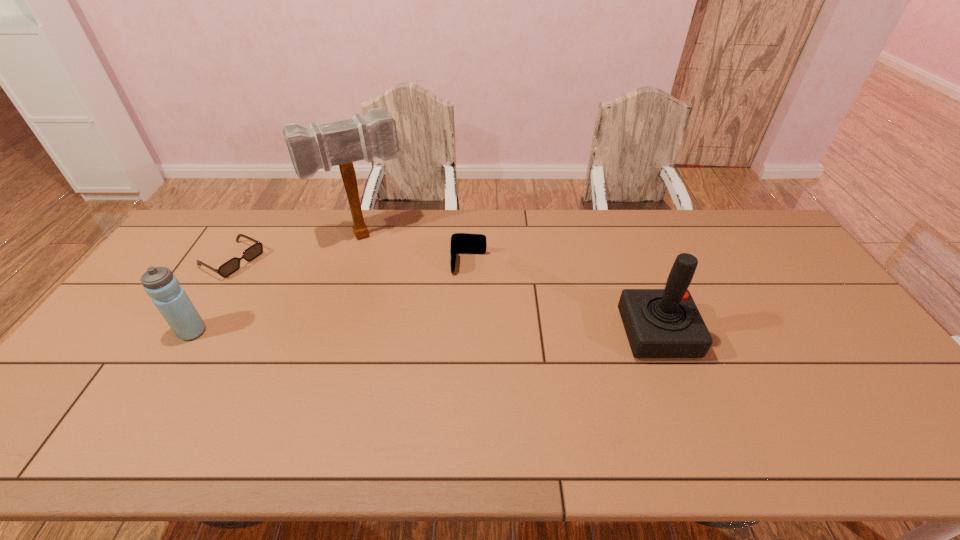
Locate an element on the screen. This screenshot has width=960, height=540. the third tallest object is located at coordinates (170, 298).

You are a GUI agent. You are given a task and a screenshot of the screen. Output one action in this format:
    pyautogui.click(x=<x>, y=<y>)
    Task: Click on the joystick
    The image size is (960, 540).
    Given the screenshot: What is the action you would take?
    pyautogui.click(x=659, y=323)

Where is `wallet`? This screenshot has width=960, height=540. wallet is located at coordinates (461, 243).

This screenshot has height=540, width=960. Identify the location of the fourth object from left to right. (461, 243).

The height and width of the screenshot is (540, 960). I want to click on the third object from right to left, so click(341, 143).

The width and height of the screenshot is (960, 540). In order to click on the tallest object in this screenshot , I will do coord(341,143).

The width and height of the screenshot is (960, 540). Find the location of `sunglasses`. sunglasses is located at coordinates (231, 266).

Find the location of a particular element. This screenshot has width=960, height=540. free region located on the back of the water bottle is located at coordinates click(x=223, y=283).

What are the coordinates of `vacant point located 0.310m on the base of the joystick` in the screenshot? It's located at (804, 334).

Locate an element on the screen. The image size is (960, 540). vacant space situated 0.320m on the outer surface of the fourth tallest object is located at coordinates [x=465, y=360].